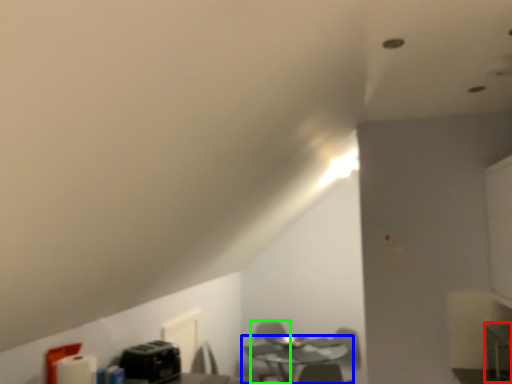
Question: Which is farther away from computer desk (highlighted by a red box)? table (highlighted by a blue box) or swivel chair (highlighted by a green box)?

Choices:
 (A) table
 (B) swivel chair

Answer: (B)